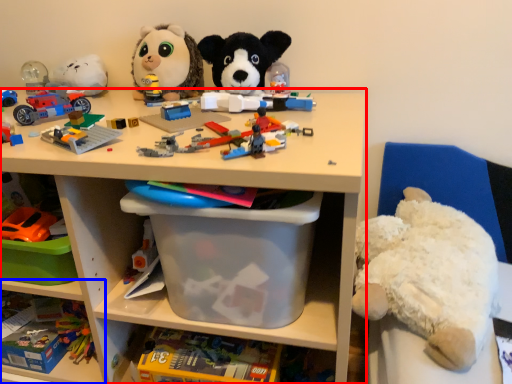
Question: Which object appears farthest to the camera in this image, shelf (highlighted by a red box) or shelf (highlighted by a blue box)?

Choices:
 (A) shelf
 (B) shelf

Answer: (B)